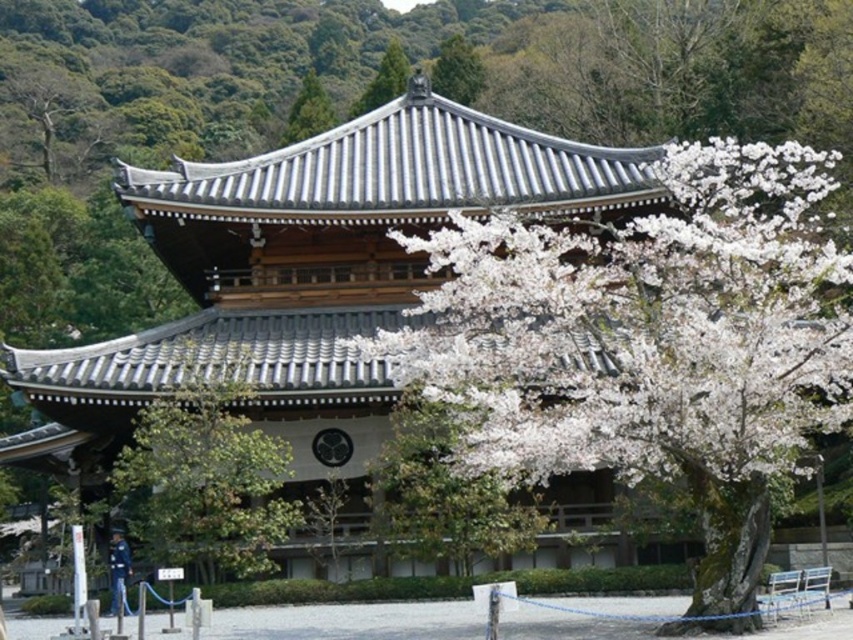
How far apart are shiny gray pagoda at center and green textured pine tree at upper center?

They are 31.26 meters apart.

Between shiny gray pagoda at center and green textured pine tree at upper center, which one appears on the right side from the viewer's perspective?

shiny gray pagoda at center is more to the right.

Does point (248, 355) come in front of point (323, 109)?

Yes, point (248, 355) is closer to viewer.

Where is `shiny gray pagoda at center`? Image resolution: width=853 pixels, height=640 pixels. shiny gray pagoda at center is located at coordinates (308, 269).

Can you confirm if shiny gray pagoda at center is taller than green leafy tree at center?

Yes.

How distant is shiny gray pagoda at center from green leafy tree at center?

shiny gray pagoda at center and green leafy tree at center are 2.68 meters apart from each other.

Is point (397, 285) positioned behind point (260, 483)?

Yes.

You are a GUI agent. You are given a task and a screenshot of the screen. Output one action in this format:
    pyautogui.click(x=<x>, y=<y>)
    Task: Click on the shiny gray pagoda at center
    The width and height of the screenshot is (853, 640).
    Given the screenshot: What is the action you would take?
    pyautogui.click(x=308, y=269)

From the picture: Who is positioned more to the left, white fluffy blossoms at right or green leafy tree at center?

From the viewer's perspective, green leafy tree at center appears more on the left side.

From the picture: Is white fluffy blossoms at right further to camera compared to green leafy tree at center?

No, it is not.

Between point (432, 300) and point (193, 522), which one is positioned behind?

The point (193, 522) is more distant.

The height and width of the screenshot is (640, 853). In order to click on white fluffy blossoms at right in this screenshot , I will do `click(643, 326)`.